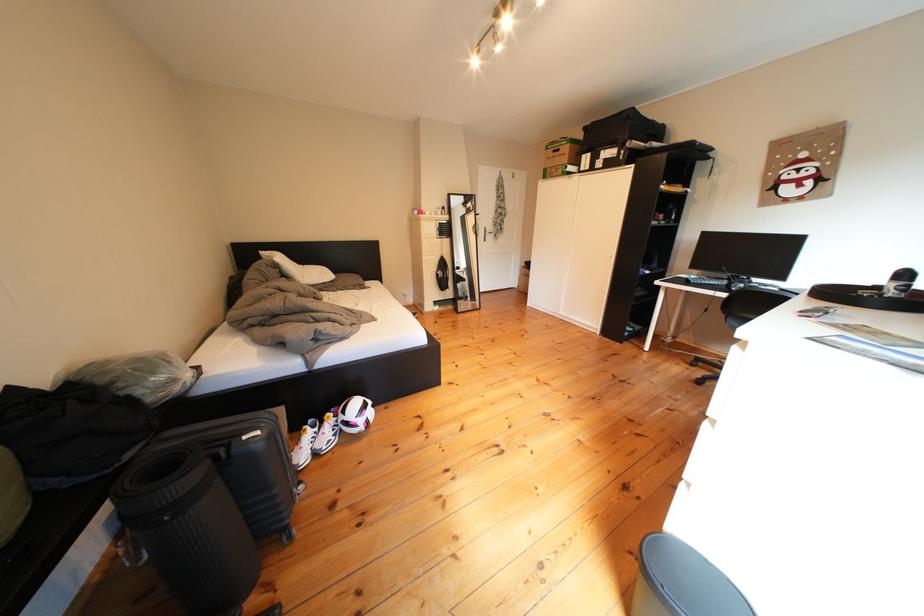
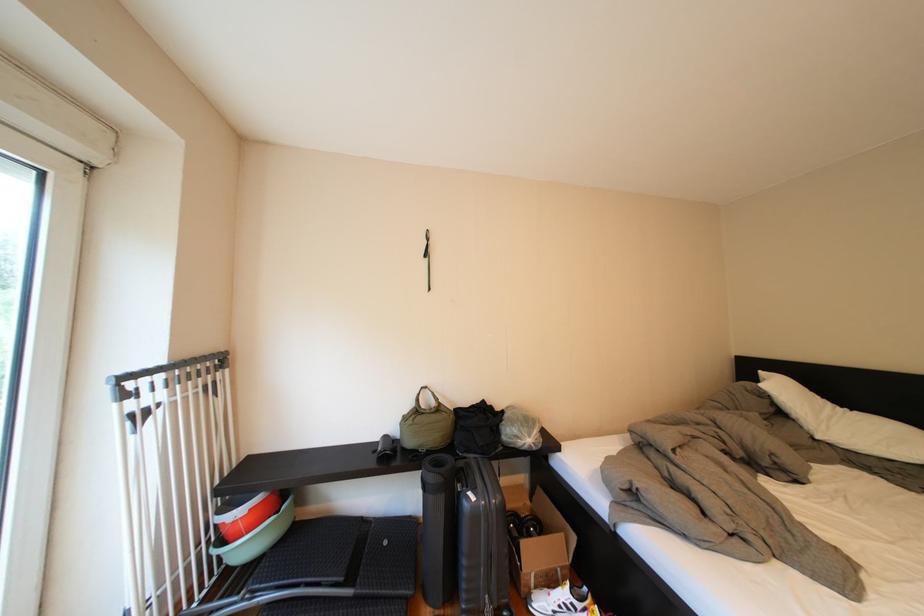
Locate, in the second image, the point that corresponds to [272,437] in the first image.

(487, 503)